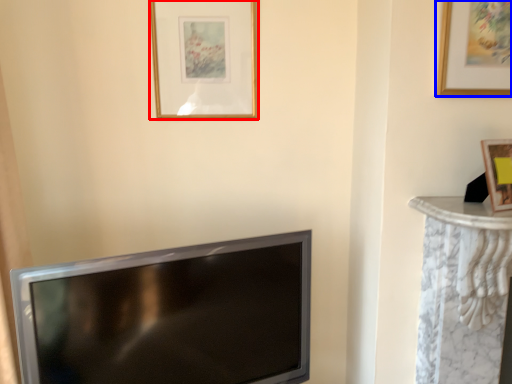
Question: Which object is further to the camera taking this photo, picture frame (highlighted by a red box) or picture frame (highlighted by a blue box)?

Choices:
 (A) picture frame
 (B) picture frame

Answer: (A)